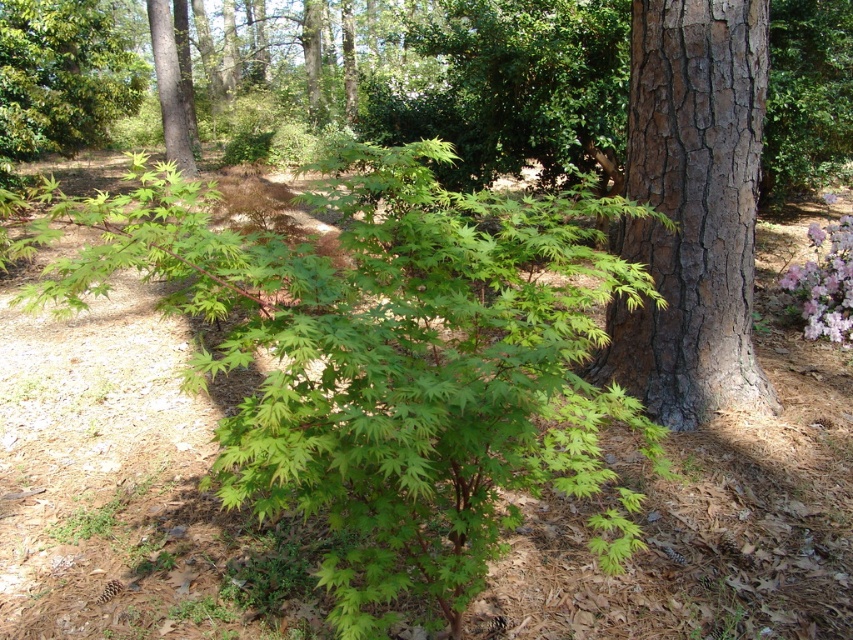
You are a hiker who wants to take a photo of the green leafy maple at center and the smooth brown tree trunk at upper center. Can you focus on both objects clearly in the same photo without moving your camera?

The green leafy maple at center is in front of the smooth brown tree trunk at upper center, so focusing on both clearly in the same photo may be challenging as they are at different distances from the camera.

You are standing in the forest and want to touch the smooth brown bark at right. Based on its coordinates, where should you look relative to your position?

The smooth brown bark at right is located at point 0.328 along the horizontal axis and 0.812 along the vertical axis, so you should look to your right and slightly downward to find it.

You are a hiker who wants to take a photo of the green leafy maple at center and the smooth brown bark at right. Since you have a camera with a fixed focal length, you need to adjust your position to ensure both objects are in the frame. Which object should you move closer to in order to include both in your photo?

You should move closer to the green leafy maple at center because it is shorter than the smooth brown bark at right. By positioning yourself closer to the shorter tree, you can better frame both objects within the camera view.